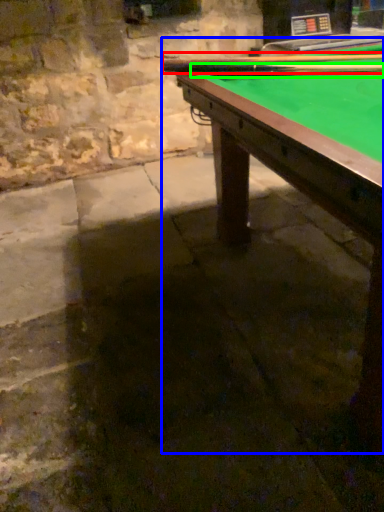
Question: Which object is positioned closest to cue (highlighted by a red box)? Select from billiard table (highlighted by a blue box) and cue (highlighted by a green box).

Choices:
 (A) billiard table
 (B) cue

Answer: (B)